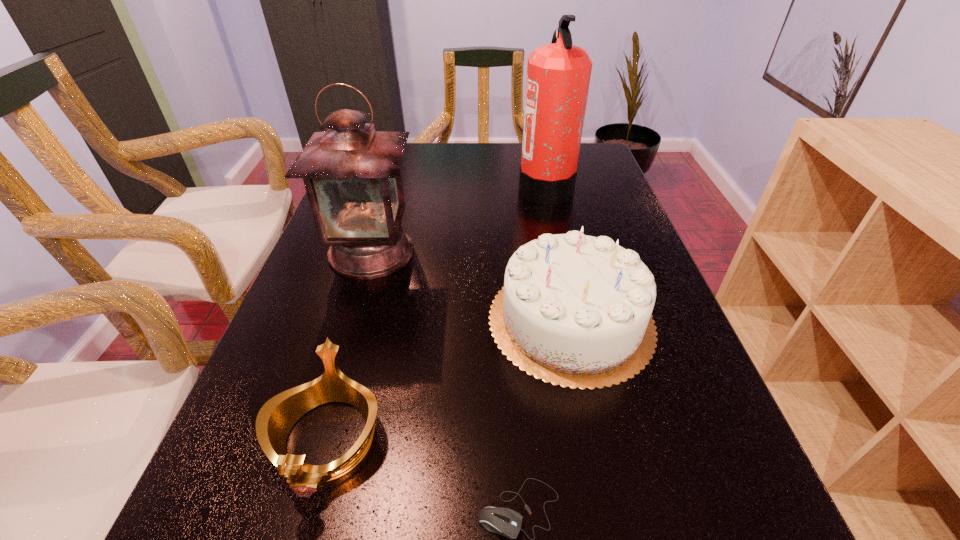
The height and width of the screenshot is (540, 960). Identify the location of object present at the far edge. (558, 74).

The height and width of the screenshot is (540, 960). I want to click on oil lamp located at the left edge, so click(x=352, y=175).

Identify the location of tiara that is at the left edge. The width and height of the screenshot is (960, 540). (278, 415).

Where is `fire extinguisher located at the right edge`? The image size is (960, 540). fire extinguisher located at the right edge is located at coordinates (558, 74).

In order to click on birthday cake present at the right edge in this screenshot , I will do [x=575, y=310].

The height and width of the screenshot is (540, 960). I want to click on object at the far right corner, so click(558, 74).

Find the location of a particular element. This screenshot has width=960, height=540. free space at the far edge of the desktop is located at coordinates (490, 147).

Locate an element on the screen. vacant space at the left edge of the desktop is located at coordinates (273, 337).

The image size is (960, 540). I want to click on blank space at the right edge, so click(619, 233).

You are a GUI agent. You are given a task and a screenshot of the screen. Output one action in this format:
    pyautogui.click(x=<x>, y=<y>)
    Task: Click on the vacant area that lies between the third shortest object and the second shortest object
    This screenshot has width=960, height=540.
    Given the screenshot: What is the action you would take?
    pyautogui.click(x=448, y=380)